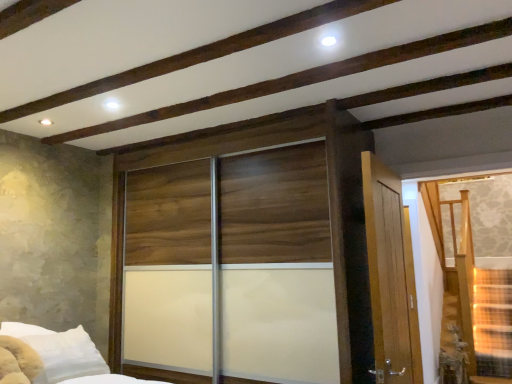
Question: From the image's perspective, is translucent glass door at right above wooden sliding door at center?

Choices:
 (A) no
 (B) yes

Answer: (B)

Question: Is translucent glass door at right next to wooden sliding door at center and touching it?

Choices:
 (A) no
 (B) yes

Answer: (A)

Question: Is translucent glass door at right shorter than wooden sliding door at center?

Choices:
 (A) no
 (B) yes

Answer: (B)

Question: Does translucent glass door at right contain wooden sliding door at center?

Choices:
 (A) no
 (B) yes

Answer: (A)

Question: Is translucent glass door at right located outside wooden sliding door at center?

Choices:
 (A) yes
 (B) no

Answer: (A)

Question: Is translucent glass door at right bigger than wooden sliding door at center?

Choices:
 (A) no
 (B) yes

Answer: (A)

Question: From the image's perspective, does wooden sliding door at center appear higher than translucent glass door at right?

Choices:
 (A) no
 (B) yes

Answer: (A)

Question: From a real-world perspective, does wooden sliding door at center stand above translucent glass door at right?

Choices:
 (A) no
 (B) yes

Answer: (B)

Question: Can you confirm if wooden sliding door at center is smaller than translucent glass door at right?

Choices:
 (A) yes
 (B) no

Answer: (B)

Question: Is wooden sliding door at center to the right of translucent glass door at right from the viewer's perspective?

Choices:
 (A) no
 (B) yes

Answer: (A)

Question: Considering the relative positions of wooden sliding door at center and translucent glass door at right in the image provided, is wooden sliding door at center to the left of translucent glass door at right from the viewer's perspective?

Choices:
 (A) no
 (B) yes

Answer: (B)

Question: Is wooden sliding door at center far from translucent glass door at right?

Choices:
 (A) yes
 (B) no

Answer: (A)

Question: Based on their positions, is translucent glass door at right located to the left or right of wooden sliding door at center?

Choices:
 (A) left
 (B) right

Answer: (B)